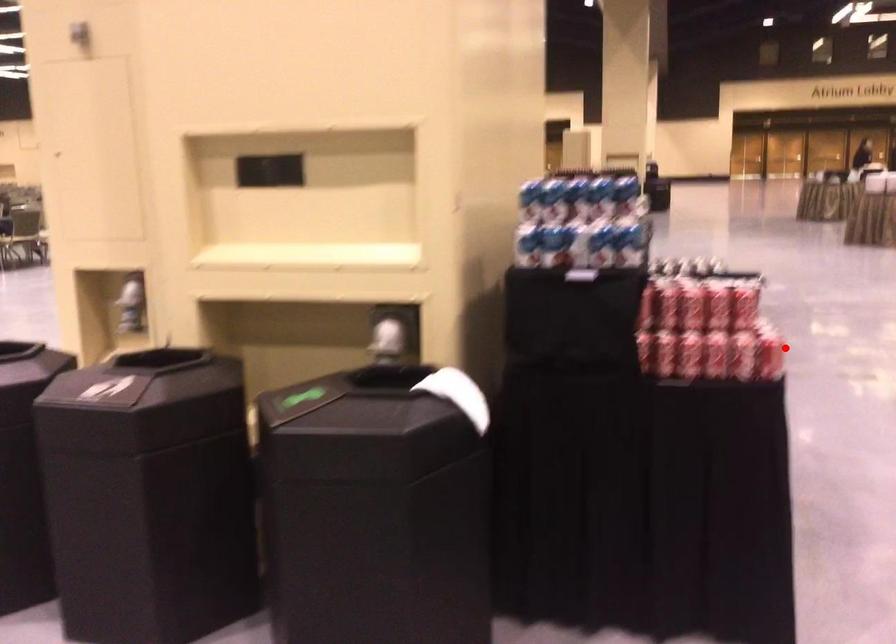
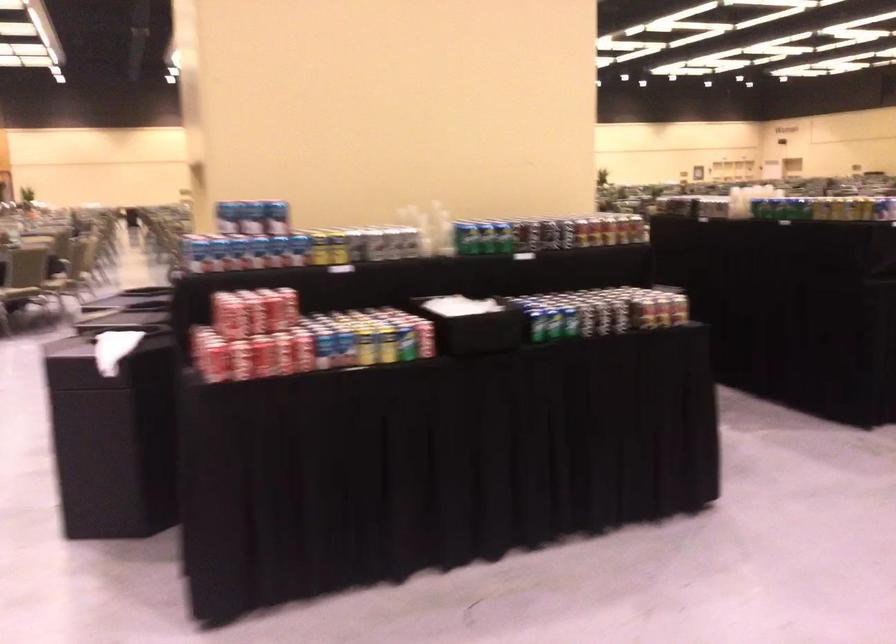
Question: I am providing you with two images of the same scene from different viewpoints. Given a red point in image1, look at the same physical point in image2. Is it:

Choices:
 (A) Closer to the viewpoint
 (B) Farther from the viewpoint

Answer: (B)